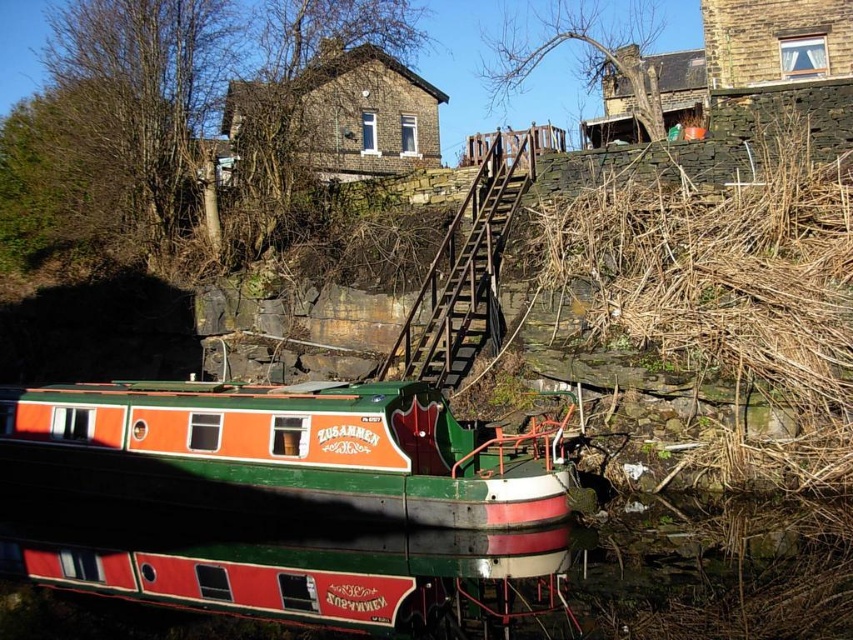
Question: Is green painted wood boat at center positioned at the back of wooden stairs at upper center?

Choices:
 (A) no
 (B) yes

Answer: (A)

Question: Which point is farther to the camera?

Choices:
 (A) green painted wood boat at center
 (B) wooden stairs at upper center

Answer: (B)

Question: From the image, what is the correct spatial relationship of green painted wood boat at center in relation to wooden stairs at upper center?

Choices:
 (A) below
 (B) above

Answer: (A)

Question: Which point is closer to the camera?

Choices:
 (A) wooden stairs at upper center
 (B) green painted wood boat at center

Answer: (B)

Question: Is green painted wood boat at center above wooden stairs at upper center?

Choices:
 (A) yes
 (B) no

Answer: (B)